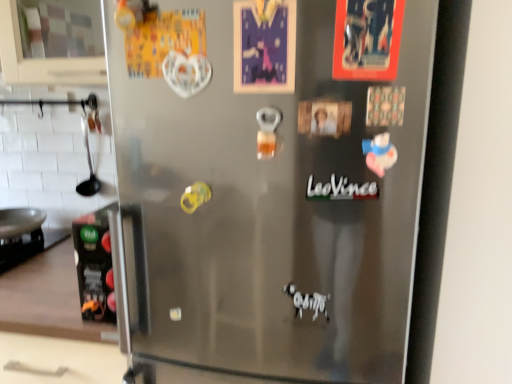
Question: Is black matte text at center behind satin silver fridge at center?

Choices:
 (A) yes
 (B) no

Answer: (A)

Question: Does black matte text at center have a lesser height compared to satin silver fridge at center?

Choices:
 (A) no
 (B) yes

Answer: (B)

Question: Is black matte text at center positioned before satin silver fridge at center?

Choices:
 (A) no
 (B) yes

Answer: (A)

Question: Is black matte text at center surrounding satin silver fridge at center?

Choices:
 (A) yes
 (B) no

Answer: (B)

Question: Is black matte text at center wider than satin silver fridge at center?

Choices:
 (A) no
 (B) yes

Answer: (A)

Question: Does black matte text at center turn towards satin silver fridge at center?

Choices:
 (A) no
 (B) yes

Answer: (B)

Question: Does black matte carton at left have a lesser width compared to satin silver fridge at center?

Choices:
 (A) no
 (B) yes

Answer: (A)

Question: From the image's perspective, is black matte carton at left located beneath satin silver fridge at center?

Choices:
 (A) yes
 (B) no

Answer: (A)

Question: From a real-world perspective, is black matte carton at left positioned over satin silver fridge at center based on gravity?

Choices:
 (A) yes
 (B) no

Answer: (B)

Question: From a real-world perspective, is black matte carton at left physically below satin silver fridge at center?

Choices:
 (A) yes
 (B) no

Answer: (A)

Question: Can you confirm if black matte carton at left is smaller than satin silver fridge at center?

Choices:
 (A) no
 (B) yes

Answer: (B)

Question: Is satin silver fridge at center inside black matte carton at left?

Choices:
 (A) yes
 (B) no

Answer: (B)

Question: Is black matte carton at left positioned behind black matte text at center?

Choices:
 (A) yes
 (B) no

Answer: (A)